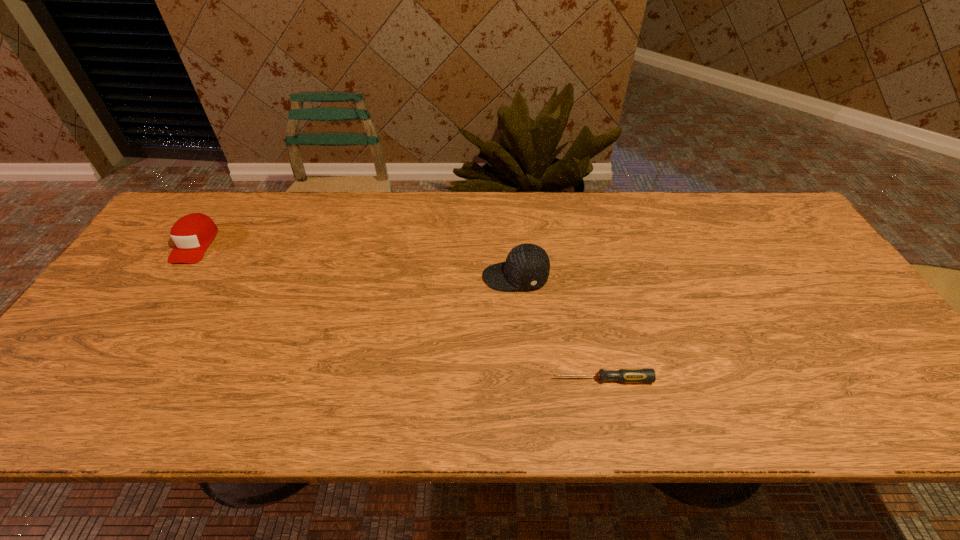
In the image, there is a desktop. Where is `vacant space at the far right corner`? vacant space at the far right corner is located at coordinates (732, 200).

Find the location of a particular element. The width and height of the screenshot is (960, 540). free space between the taller baseball cap and the shorter baseball cap is located at coordinates (355, 260).

Where is `empty space between the tallest object and the second tallest object`? empty space between the tallest object and the second tallest object is located at coordinates (355, 260).

The width and height of the screenshot is (960, 540). Find the location of `free space between the tallest object and the leftmost object`. free space between the tallest object and the leftmost object is located at coordinates (355, 260).

This screenshot has width=960, height=540. I want to click on free space between the nearest object and the right baseball cap, so click(x=559, y=328).

Identify the location of blank region between the nearest object and the left baseball cap. (398, 312).

The width and height of the screenshot is (960, 540). In order to click on vacant space that is in between the nearest object and the left baseball cap in this screenshot , I will do `click(398, 312)`.

The height and width of the screenshot is (540, 960). Find the location of `unoccupied area between the tallest object and the nearest object`. unoccupied area between the tallest object and the nearest object is located at coordinates (559, 328).

Locate an element on the screen. Image resolution: width=960 pixels, height=540 pixels. vacant area between the shortest object and the right baseball cap is located at coordinates (559, 328).

Find the location of a particular element. free space between the nearest object and the leftmost object is located at coordinates (398, 312).